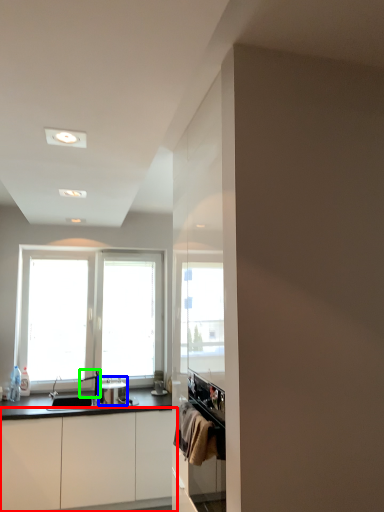
Question: Considering the real-world distances, which object is closest to cabinetry (highlighted by a red box)? appliance (highlighted by a blue box) or faucet (highlighted by a green box).

Choices:
 (A) appliance
 (B) faucet

Answer: (A)